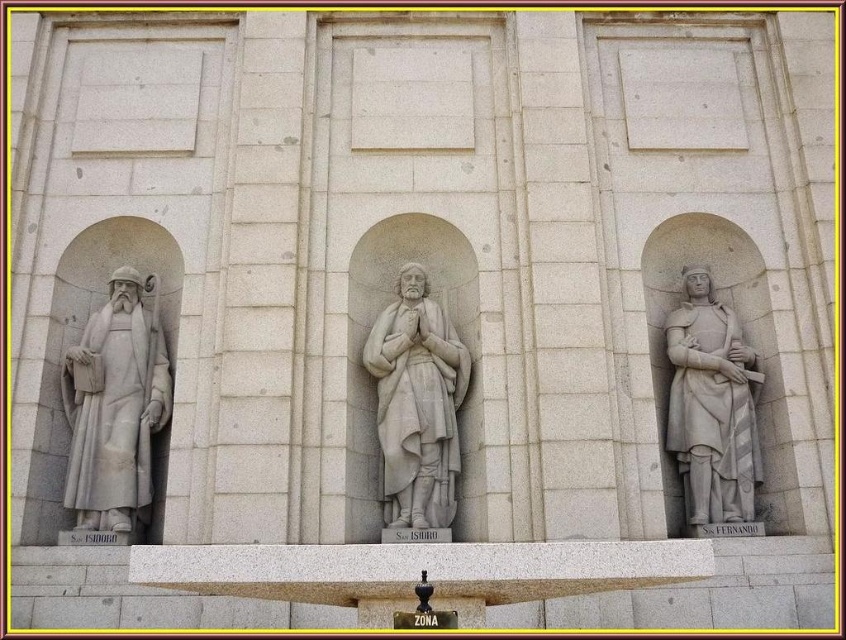
Question: Estimate the real-world distances between objects in this image. Which object is closer to the white marble statue at left?

Choices:
 (A) white stone statue at right
 (B) white marble statue at center

Answer: (B)

Question: Is white marble statue at left smaller than white marble statue at center?

Choices:
 (A) no
 (B) yes

Answer: (A)

Question: Can you confirm if white marble statue at left is positioned to the right of white stone statue at right?

Choices:
 (A) yes
 (B) no

Answer: (B)

Question: Which object appears farthest from the camera in this image?

Choices:
 (A) white marble statue at center
 (B) white stone statue at right

Answer: (B)

Question: Can you confirm if white marble statue at left is smaller than white stone statue at right?

Choices:
 (A) no
 (B) yes

Answer: (B)

Question: Estimate the real-world distances between objects in this image. Which object is farther from the white stone statue at right?

Choices:
 (A) white marble statue at left
 (B) white marble statue at center

Answer: (A)